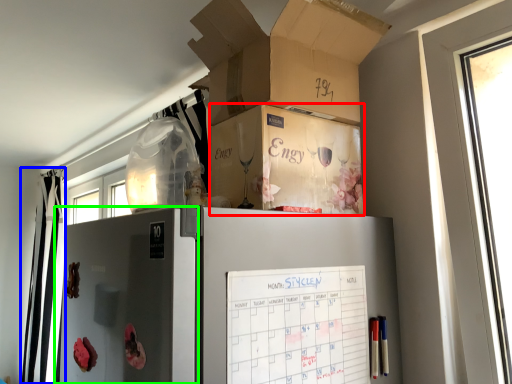
Question: Which is farther away from storage box (highlighted by a red box)? curtain (highlighted by a blue box) or screen door (highlighted by a green box)?

Choices:
 (A) curtain
 (B) screen door

Answer: (A)